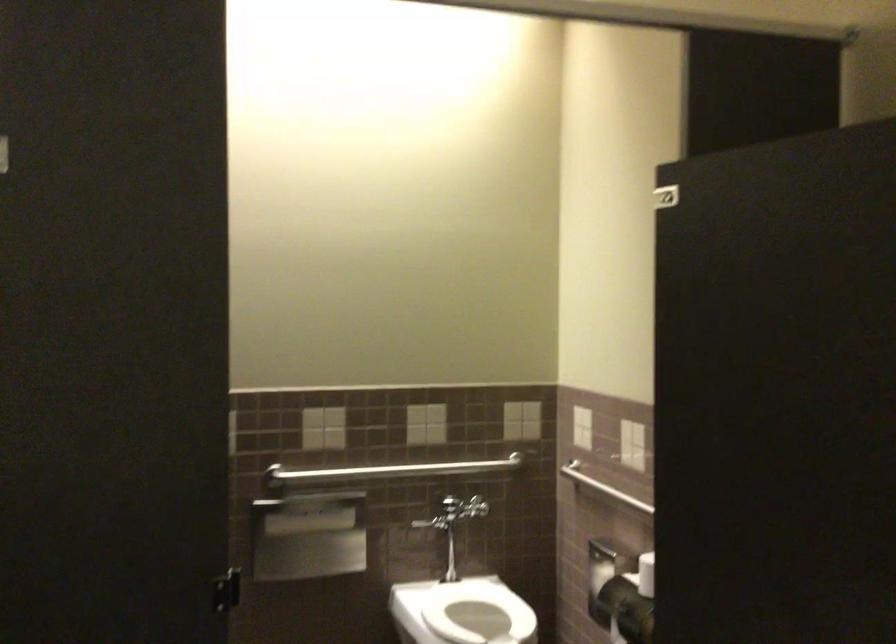
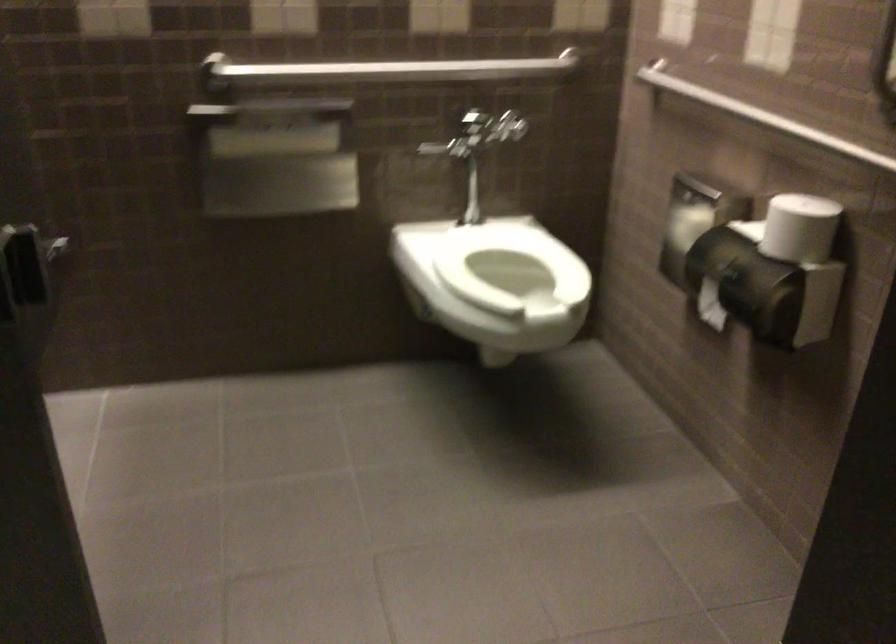
Question: Based on the continuous images, in which direction is the camera rotating? Reply with the corresponding letter.

Choices:
 (A) Left
 (B) Right
 (C) Up
 (D) Down

Answer: (D)